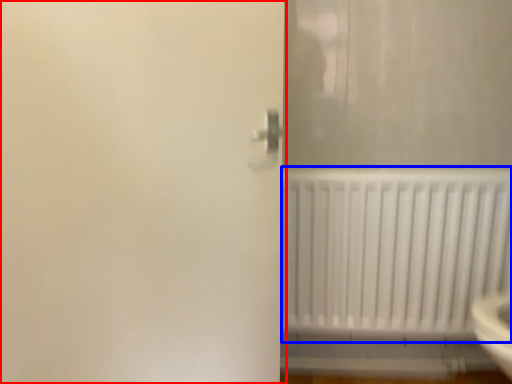
Question: Among these objects, which one is nearest to the camera, screen door (highlighted by a red box) or radiator (highlighted by a blue box)?

Choices:
 (A) screen door
 (B) radiator

Answer: (A)